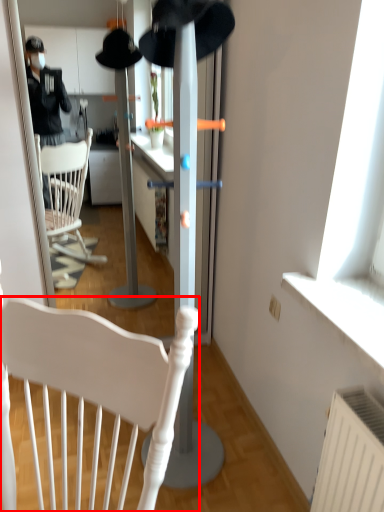
Question: From the image's perspective, where is chair (annotated by the red box) located relative to hat?

Choices:
 (A) above
 (B) below

Answer: (B)